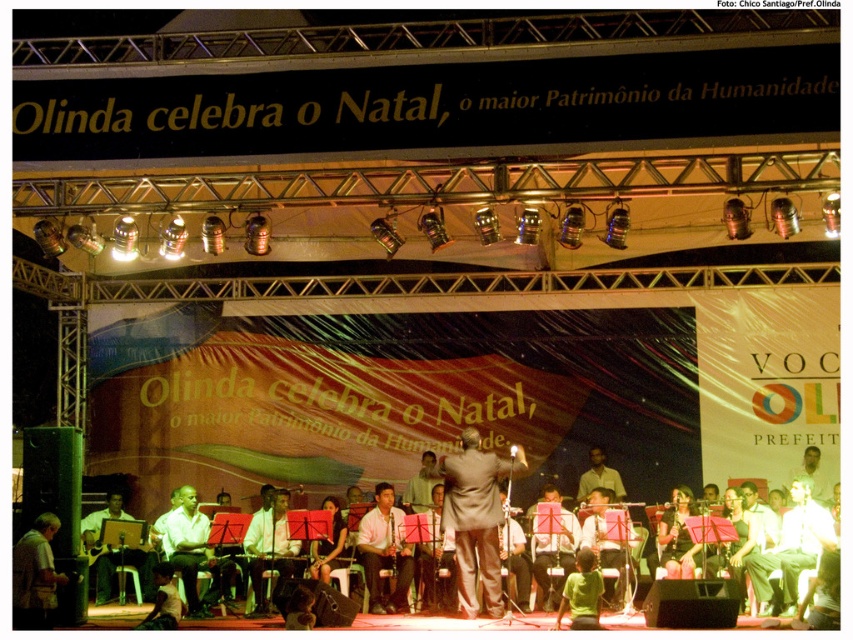
Which is behind, point (488, 557) or point (247, 538)?

Positioned behind is point (247, 538).

Which of these two, dark gray suit at center or light brown wood drum at center, stands shorter?

light brown wood drum at center

The image size is (853, 640). What do you see at coordinates (476, 518) in the screenshot?
I see `dark gray suit at center` at bounding box center [476, 518].

The height and width of the screenshot is (640, 853). In order to click on dark gray suit at center in this screenshot , I will do `click(476, 518)`.

Does smooth brown saxophone at center lie in front of light brown wood chair at lower left?

No.

Who is positioned more to the left, smooth brown saxophone at center or light brown wood chair at lower left?

From the viewer's perspective, light brown wood chair at lower left appears more on the left side.

Which is in front, point (361, 525) or point (218, 586)?

Point (218, 586)

Find the location of a particular element. The image size is (853, 640). smooth brown saxophone at center is located at coordinates (384, 552).

Can you confirm if dark gray suit at center is shorter than smooth brown saxophone at center?

Incorrect, dark gray suit at center's height does not fall short of smooth brown saxophone at center's.

This screenshot has width=853, height=640. Describe the element at coordinates (476, 518) in the screenshot. I see `dark gray suit at center` at that location.

Does point (474, 531) come farther from viewer compared to point (392, 497)?

No, (474, 531) is in front of (392, 497).

You are a GUI agent. You are given a task and a screenshot of the screen. Output one action in this format:
    pyautogui.click(x=<x>, y=<y>)
    Task: Click on the dark gray suit at center
    This screenshot has height=640, width=853.
    Given the screenshot: What is the action you would take?
    pyautogui.click(x=476, y=518)